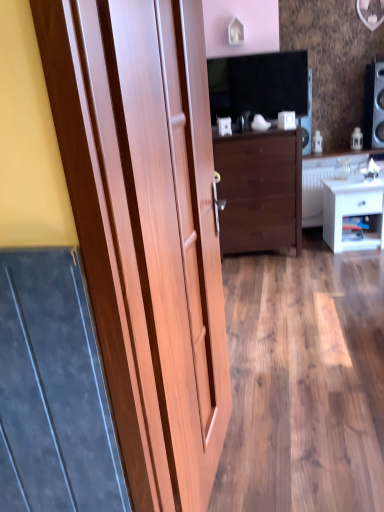
Question: Could wooden door at left be considered to be inside white glossy nightstand at lower right?

Choices:
 (A) no
 (B) yes

Answer: (A)

Question: Does white glossy nightstand at lower right have a lesser height compared to wooden door at left?

Choices:
 (A) no
 (B) yes

Answer: (B)

Question: Considering the relative sizes of white glossy nightstand at lower right and wooden door at left in the image provided, is white glossy nightstand at lower right taller than wooden door at left?

Choices:
 (A) no
 (B) yes

Answer: (A)

Question: Is white glossy nightstand at lower right placed right next to wooden door at left?

Choices:
 (A) no
 (B) yes

Answer: (A)

Question: Does white glossy nightstand at lower right have a lesser width compared to wooden door at left?

Choices:
 (A) yes
 (B) no

Answer: (B)

Question: From the image's perspective, is white glossy nightstand at lower right on wooden door at left?

Choices:
 (A) no
 (B) yes

Answer: (B)

Question: From a real-world perspective, is white glossy counter top at center under dark wood chest of drawers at center?

Choices:
 (A) yes
 (B) no

Answer: (B)

Question: Can dark wood chest of drawers at center be found inside white glossy counter top at center?

Choices:
 (A) yes
 (B) no

Answer: (B)

Question: Is white glossy counter top at center at the right side of dark wood chest of drawers at center?

Choices:
 (A) no
 (B) yes

Answer: (B)

Question: Does white glossy counter top at center lie in front of dark wood chest of drawers at center?

Choices:
 (A) yes
 (B) no

Answer: (B)

Question: From the image's perspective, is white glossy counter top at center under dark wood chest of drawers at center?

Choices:
 (A) no
 (B) yes

Answer: (A)

Question: Is white glossy counter top at center located outside dark wood chest of drawers at center?

Choices:
 (A) yes
 (B) no

Answer: (A)

Question: Is wooden door at left oriented towards white glossy nightstand at lower right?

Choices:
 (A) no
 (B) yes

Answer: (A)